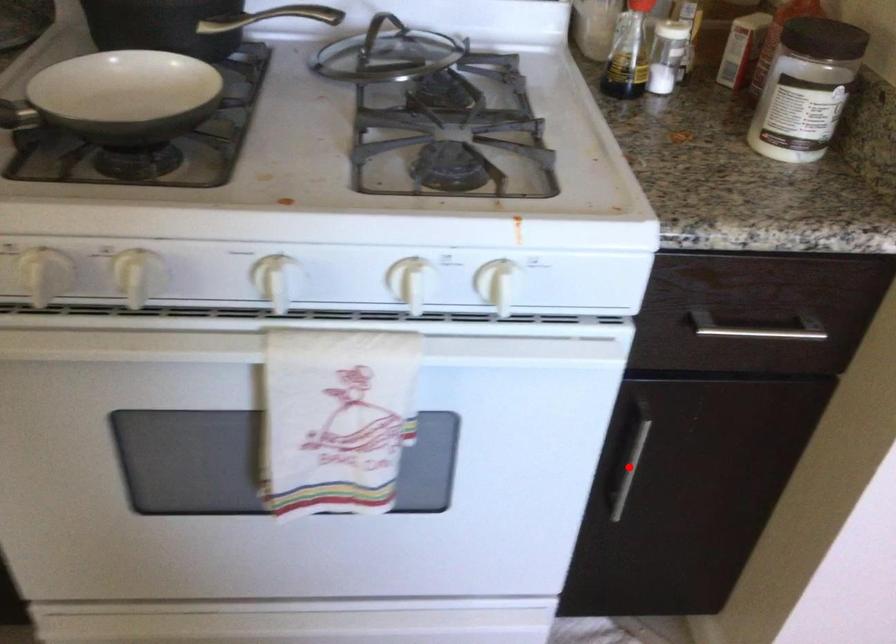
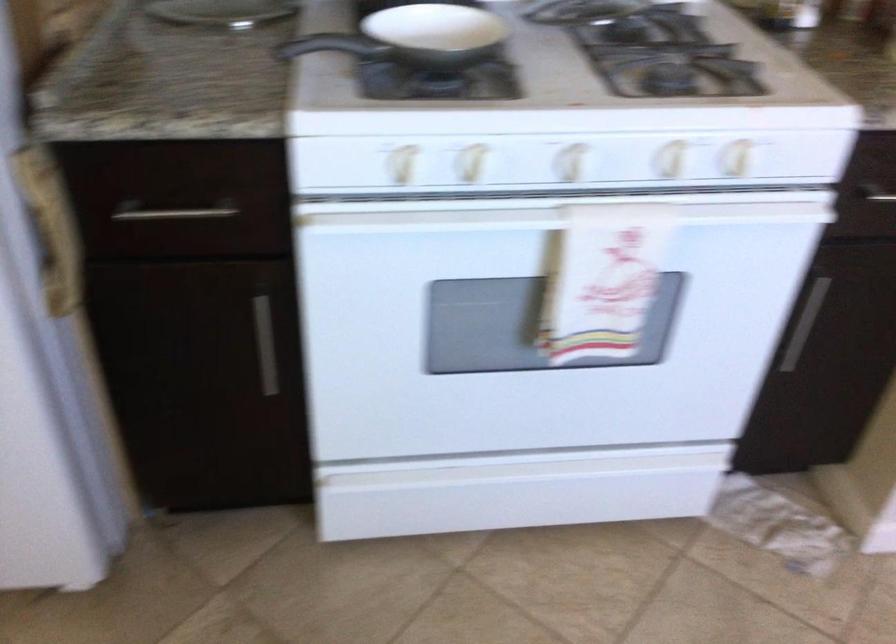
The point at the highlighted location is marked in the first image. Where is the corresponding point in the second image?

(805, 323)